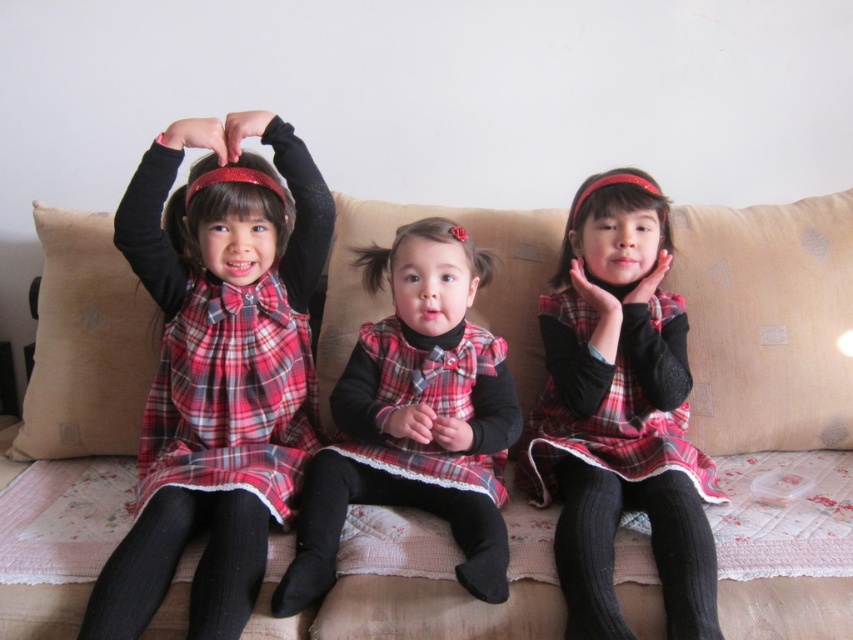
Question: Can you confirm if plaid fabric dress at left is positioned to the left of plaid fabric dress at center?

Choices:
 (A) no
 (B) yes

Answer: (B)

Question: Does beige fabric couch at center appear over plaid fabric dress at center?

Choices:
 (A) yes
 (B) no

Answer: (A)

Question: Among these objects, which one is farthest from the camera?

Choices:
 (A) beige fabric couch at center
 (B) plaid fabric dress at left

Answer: (A)

Question: Which point is closer to the camera?

Choices:
 (A) 599,518
 (B) 601,177

Answer: (A)

Question: Can you confirm if beige fabric couch at center is thinner than black ribbed sock at lower right?

Choices:
 (A) no
 (B) yes

Answer: (A)

Question: Which point is farther to the camera?

Choices:
 (A) (344, 250)
 (B) (398, 369)
 (C) (601, 637)

Answer: (A)